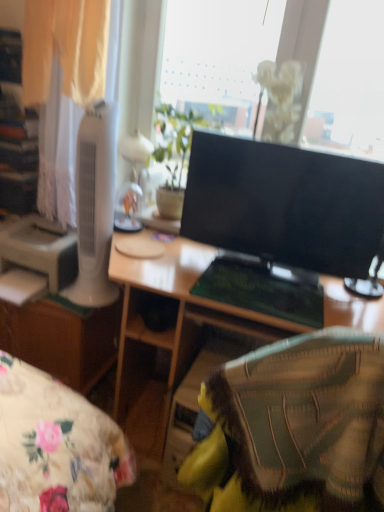
Identify the location of black glossy monitor at center. (284, 204).

The width and height of the screenshot is (384, 512). What are the coordinates of `wooden desk at center` in the screenshot? It's located at (168, 334).

What is the approximate width of white plastic tower fan at left?

6.44 inches.

Image resolution: width=384 pixels, height=512 pixels. Identify the location of black glossy monitor at center. (284, 204).

Which is in front, black glossy monitor at center or white sheer curtain at left?

black glossy monitor at center is in front.

Can you confirm if black glossy monitor at center is positioned to the right of white sheer curtain at left?

Indeed, black glossy monitor at center is positioned on the right side of white sheer curtain at left.

Is matte white table lamp at upper center far away from white sheer curtain at left?

No, matte white table lamp at upper center is not far away from white sheer curtain at left.

Which object is more forward, matte white table lamp at upper center or white sheer curtain at left?

white sheer curtain at left is in front.

Between point (134, 170) and point (107, 0), which one is positioned in front?

The point (107, 0) is more forward.

Looking at their sizes, would you say matte white table lamp at upper center is wider or thinner than white sheer curtain at left?

Considering their sizes, matte white table lamp at upper center looks slimmer than white sheer curtain at left.

How many degrees apart are the facing directions of white plastic tower fan at left and white sheer curtain at left?

white plastic tower fan at left and white sheer curtain at left are facing 0.523 degrees away from each other.

Considering the relative positions of white plastic tower fan at left and white sheer curtain at left in the image provided, is white plastic tower fan at left in front of white sheer curtain at left?

No.

From a real-world perspective, is white plastic tower fan at left physically above white sheer curtain at left?

Incorrect, from a real-world perspective, white plastic tower fan at left is lower than white sheer curtain at left.

Is matte white table lamp at upper center directly adjacent to black glossy monitor at center?

No.

Could you tell me if matte white table lamp at upper center is turned towards black glossy monitor at center?

No, matte white table lamp at upper center is not oriented towards black glossy monitor at center.

Between matte white table lamp at upper center and black glossy monitor at center, which one has smaller size?

matte white table lamp at upper center is smaller.

From a real-world perspective, is black glossy monitor at center below green leafy plant at upper center?

Correct, in the physical world, black glossy monitor at center is lower than green leafy plant at upper center.

Considering the positions of objects black glossy monitor at center and green leafy plant at upper center in the image provided, who is in front, black glossy monitor at center or green leafy plant at upper center?

black glossy monitor at center is more forward.

Can you confirm if black glossy monitor at center is taller than green leafy plant at upper center?

No.

Which of these two, black glossy monitor at center or green leafy plant at upper center, is bigger?

black glossy monitor at center is bigger.

Which object is thinner, white sheer curtain at left or black glossy monitor at center?

With smaller width is black glossy monitor at center.

Can you tell me how much white sheer curtain at left and black glossy monitor at center differ in facing direction?

The angle between the facing direction of white sheer curtain at left and the facing direction of black glossy monitor at center is 5.31 degrees.

Is point (108, 42) closer or farther from the camera than point (371, 207)?

Point (108, 42) is farther from the camera than point (371, 207).

Can we say white sheer curtain at left lies outside black glossy monitor at center?

Yes, white sheer curtain at left is not within black glossy monitor at center.

From a real-world perspective, is matte white table lamp at upper center physically located above or below green leafy plant at upper center?

In terms of real-world spatial position, matte white table lamp at upper center is below green leafy plant at upper center.

Is matte white table lamp at upper center next to green leafy plant at upper center?

There is a gap between matte white table lamp at upper center and green leafy plant at upper center.

Does point (138, 156) come behind point (171, 152)?

Yes, it is behind point (171, 152).

From the image's perspective, is matte white table lamp at upper center located above green leafy plant at upper center?

Yes.

The height and width of the screenshot is (512, 384). In order to click on television on the right of the white sheer curtain at left in this screenshot , I will do `click(284, 204)`.

This screenshot has height=512, width=384. Identify the location of table lamp behind the white sheer curtain at left. (135, 151).

Looking at the image, which one is located closer to white plastic tower fan at left, matte white table lamp at upper center or wooden desk at center?

matte white table lamp at upper center is positioned closer to the anchor white plastic tower fan at left.

Estimate the real-world distances between objects in this image. Which object is further from white plastic tower fan at left, white plastic printer at left or green leafy plant at upper center?

green leafy plant at upper center is further to white plastic tower fan at left.

From the image, which object appears to be nearer to black glossy monitor at center, white sheer curtain at left or wooden desk at center?

The object closer to black glossy monitor at center is wooden desk at center.

Based on their spatial positions, is green leafy plant at upper center or white sheer curtain at left further from white plastic printer at left?

green leafy plant at upper center.

Which object lies nearer to the anchor point green leafy plant at upper center, white plastic printer at left or matte white table lamp at upper center?

matte white table lamp at upper center is positioned closer to the anchor green leafy plant at upper center.

Estimate the real-world distances between objects in this image. Which object is closer to white plastic tower fan at left, white plastic printer at left or black glossy monitor at center?

white plastic printer at left is closer to white plastic tower fan at left.

Which object lies nearer to the anchor point green leafy plant at upper center, black glossy monitor at center or white plastic tower fan at left?

Among the two, white plastic tower fan at left is located nearer to green leafy plant at upper center.

Considering their positions, is wooden desk at center positioned closer to green leafy plant at upper center than matte white table lamp at upper center?

The object closer to green leafy plant at upper center is matte white table lamp at upper center.

Identify the location of home appliance between wooden desk at center and matte white table lamp at upper center along the z-axis. Image resolution: width=384 pixels, height=512 pixels. (95, 205).

Locate an element on the screen. The image size is (384, 512). houseplant located between wooden desk at center and matte white table lamp at upper center in the depth direction is located at coordinates (173, 154).

The height and width of the screenshot is (512, 384). What are the coordinates of `table lamp between white sheer curtain at left and black glossy monitor at center` in the screenshot? It's located at (135, 151).

You are a GUI agent. You are given a task and a screenshot of the screen. Output one action in this format:
    pyautogui.click(x=<x>, y=<y>)
    Task: Click on the table lamp located between white plastic printer at left and green leafy plant at upper center in the left-right direction
    
    Given the screenshot: What is the action you would take?
    pyautogui.click(x=135, y=151)